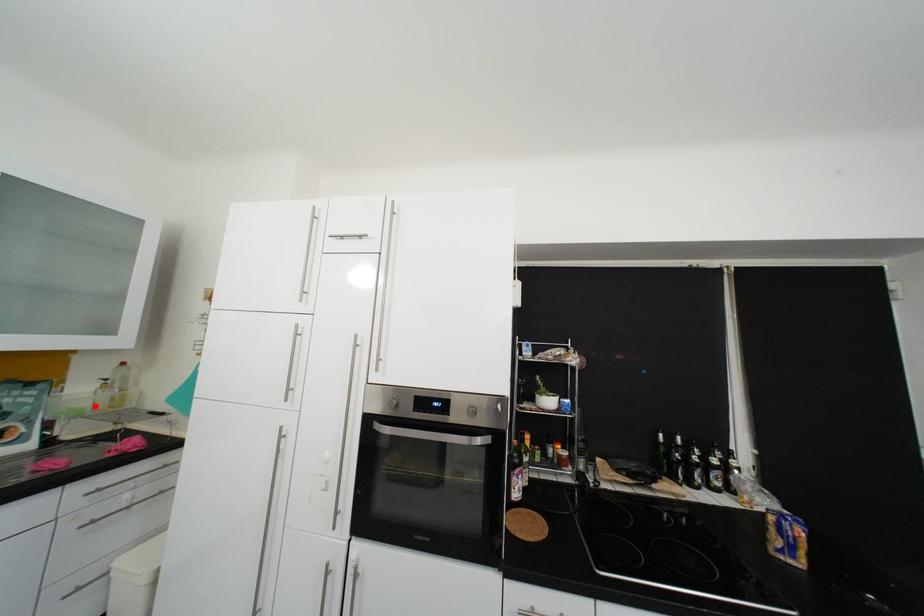
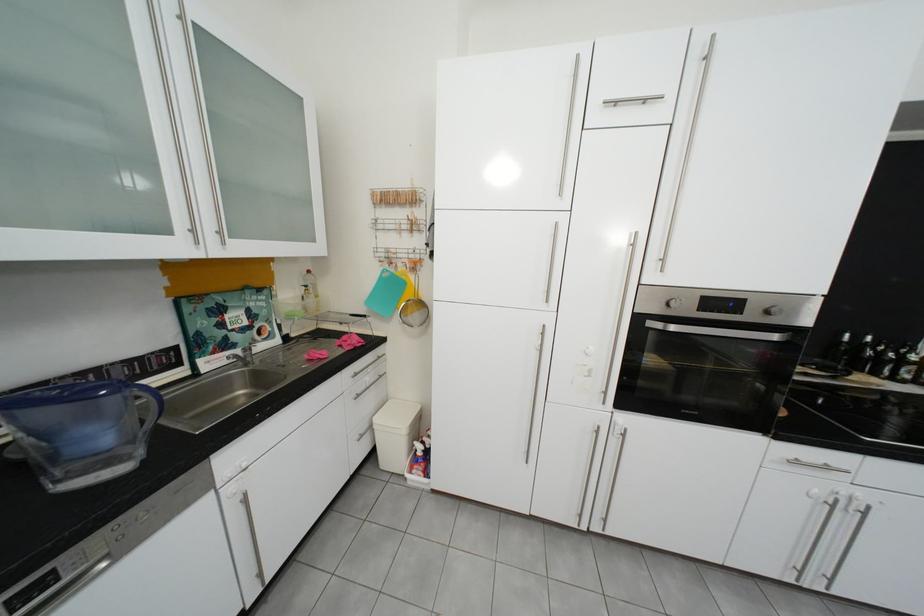
In the second image, find the point that corresponds to the highlighted location in the first image.

(311, 310)